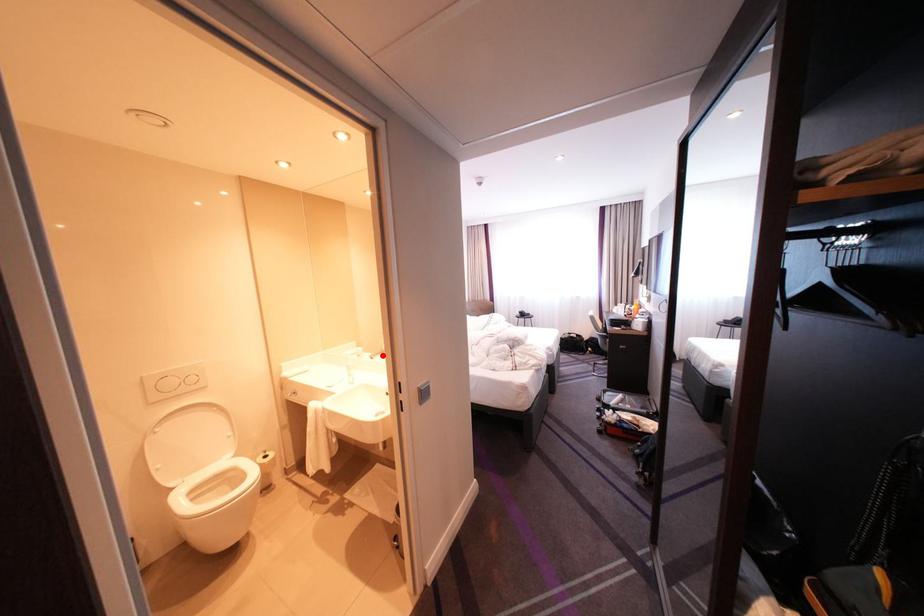
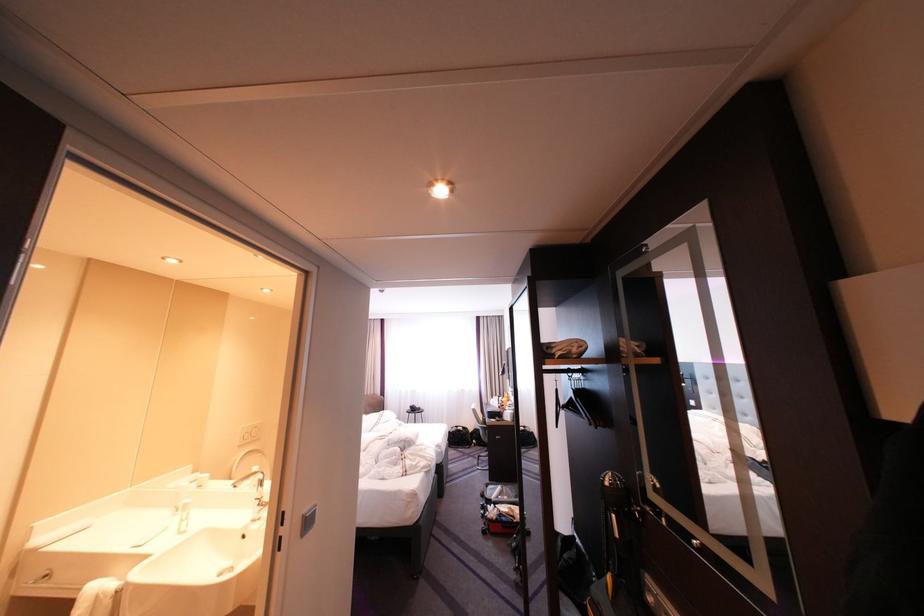
In the second image, find the point that corresponds to the highlighted location in the first image.

(245, 483)